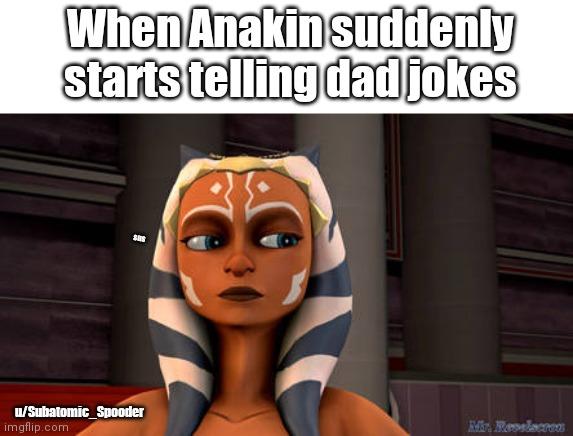
The height and width of the screenshot is (436, 573). I want to click on wall, so click(50, 260).